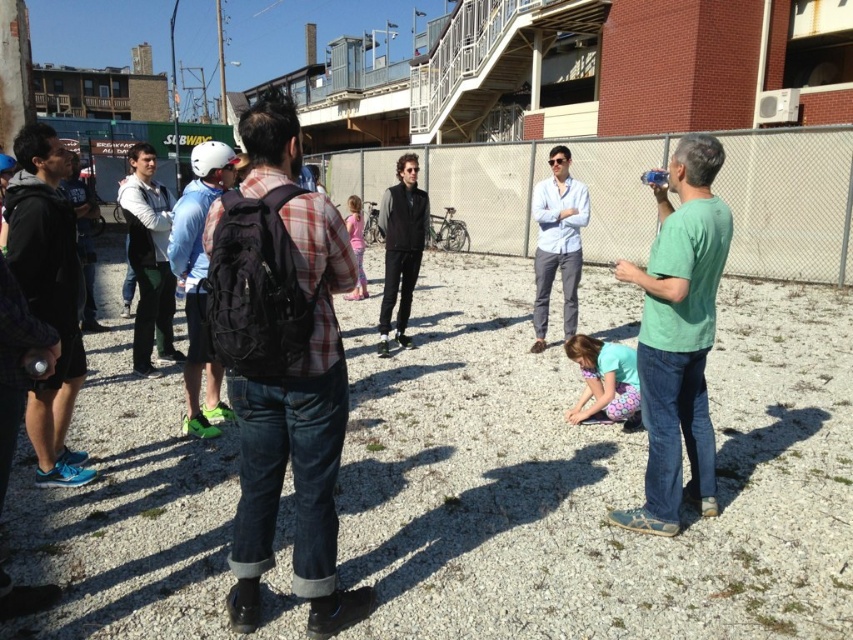
From the picture: Is matte black backpack at center-left below black matte vest at center?

Yes.

The image size is (853, 640). Identify the location of matte black backpack at center-left. point(199,282).

At what (x,y) coordinates should I click in order to perform the action: click on matte black backpack at center-left. Please return your answer as a coordinate pair (x, y). The height and width of the screenshot is (640, 853). Looking at the image, I should click on (199, 282).

Who is positioned more to the left, denim jeans at center or black matte vest at center?

denim jeans at center

Is point (270, 435) closer to camera compared to point (387, 188)?

That is True.

Locate an element on the screen. The width and height of the screenshot is (853, 640). denim jeans at center is located at coordinates (282, 365).

Based on the photo, can you confirm if light blue fabric at lower center is positioned above matte black backpack at center?

No.

Who is more distant from viewer, (608, 385) or (67, 196)?

The point (67, 196) is behind.

Find the location of a particular element. light blue fabric at lower center is located at coordinates (602, 380).